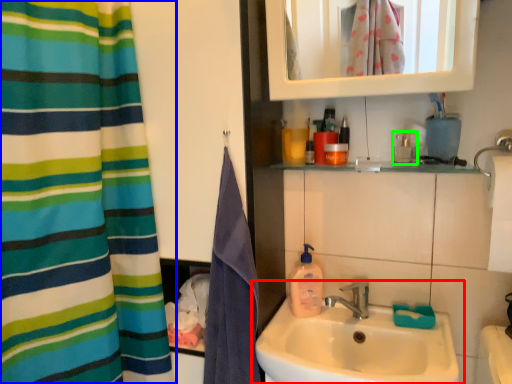
Question: Estimate the real-world distances between objects in this image. Which object is farther from sink (highlighted by a red box), curtain (highlighted by a blue box) or mouthwash (highlighted by a green box)?

Choices:
 (A) curtain
 (B) mouthwash

Answer: (A)